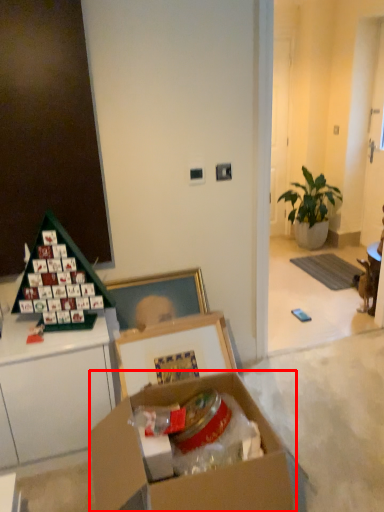
Question: In this image, where is box (annotated by the red box) located relative to houseplant?

Choices:
 (A) left
 (B) right

Answer: (A)